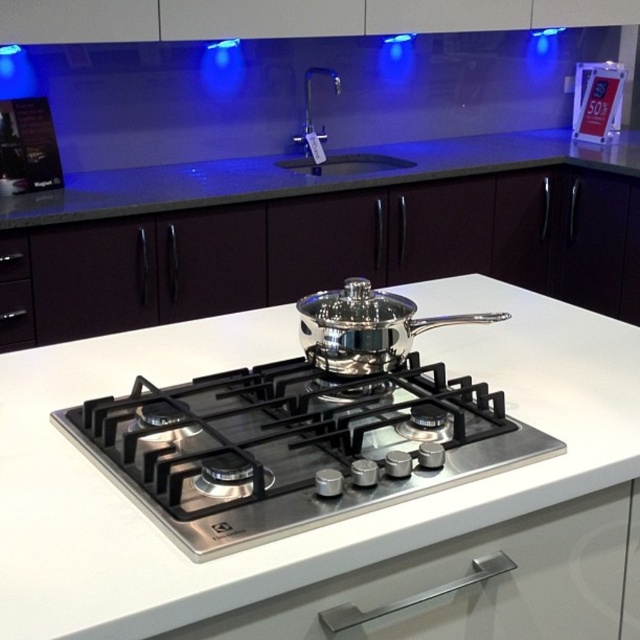
You are standing in a modern kitchen and want to reach the stainless steel gas stove at center to adjust the burner. Considering your arm length is 28 inches, can you comfortably reach it without moving closer?

The stainless steel gas stove at center is 30.84 inches away from the viewer. Since your arm length is 28 inches, you would need to move closer to comfortably reach it.

You are standing in front of the modern kitchen shown. There is a white glossy countertop at center marked by point (310, 529). If you want to place a small bowl exactly at the center of the white glossy countertop at center, where should you place it?

The center of the white glossy countertop at center is exactly at point (310, 529), so place the bowl there.

You are organizing the kitchen and need to place a new spice jar between the white glossy countertop at center and the metallic silver pot at upper right. According to their positions, where should you place the spice jar?

The white glossy countertop at center is positioned on the left side of the metallic silver pot at upper right, so you should place the spice jar between them, closer to the white glossy countertop at center to maintain the left alignment.